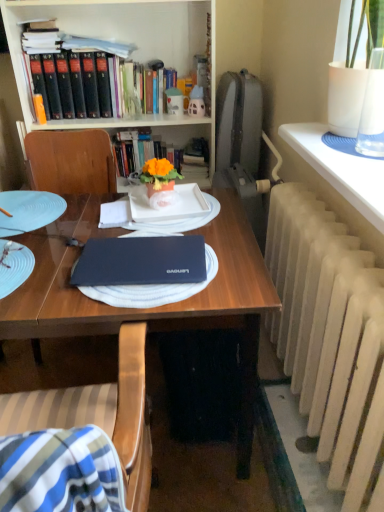
You are a GUI agent. You are given a task and a screenshot of the screen. Output one action in this format:
    pyautogui.click(x=<x>, y=<y>)
    Task: Click on the free space in front of matte black laptop at center
    This screenshot has height=512, width=384.
    Given the screenshot: What is the action you would take?
    pyautogui.click(x=134, y=306)